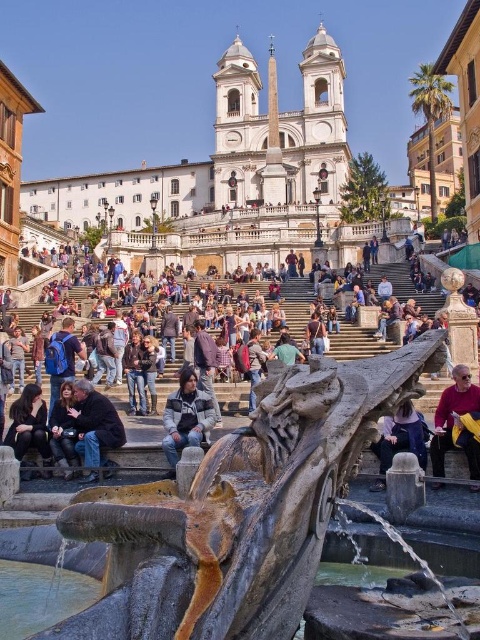
Is rustic stone fountain at center taller than dark gray stone jacket at lower left?

Correct, rustic stone fountain at center is much taller as dark gray stone jacket at lower left.

I want to click on rustic stone fountain at center, so click(229, 512).

What do you see at coordinates (229, 512) in the screenshot?
I see `rustic stone fountain at center` at bounding box center [229, 512].

Where is `rustic stone fountain at center`? This screenshot has height=640, width=480. rustic stone fountain at center is located at coordinates (229, 512).

Which is in front, point (284, 577) or point (176, 397)?

Point (284, 577) is in front.

Can you confirm if rustic stone fountain at center is positioned to the right of dark gray jacket at center?

Correct, you'll find rustic stone fountain at center to the right of dark gray jacket at center.

You are a GUI agent. You are given a task and a screenshot of the screen. Output one action in this format:
    pyautogui.click(x=<x>, y=<y>)
    Task: Click on the rustic stone fountain at center
    The height and width of the screenshot is (640, 480).
    Given the screenshot: What is the action you would take?
    pyautogui.click(x=229, y=512)

Describe the element at coordinates (186, 419) in the screenshot. This screenshot has height=640, width=480. I see `dark gray jacket at center` at that location.

Is dark gray jacket at center bigger than dark brown leather jacket at lower left?

Indeed, dark gray jacket at center has a larger size compared to dark brown leather jacket at lower left.

Measure the distance between dark gray jacket at center and camera.

A distance of 35.79 meters exists between dark gray jacket at center and camera.

Locate an element on the screen. dark gray jacket at center is located at coordinates (186, 419).